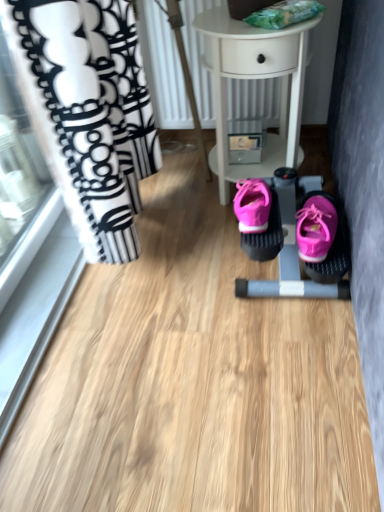
Question: Can pink suede shoe at center be found inside white glossy table at center?

Choices:
 (A) no
 (B) yes

Answer: (A)

Question: Is white glossy table at center positioned in front of pink suede shoe at center?

Choices:
 (A) no
 (B) yes

Answer: (A)

Question: Does white glossy table at center have a lesser width compared to pink suede shoe at center?

Choices:
 (A) no
 (B) yes

Answer: (A)

Question: Considering the relative sizes of white glossy table at center and pink suede shoe at center in the image provided, is white glossy table at center taller than pink suede shoe at center?

Choices:
 (A) yes
 (B) no

Answer: (A)

Question: Is white glossy table at center not near pink suede shoe at center?

Choices:
 (A) yes
 (B) no

Answer: (B)

Question: Does point (276, 182) appear closer or farther from the camera than point (309, 208)?

Choices:
 (A) closer
 (B) farther

Answer: (B)

Question: From a real-world perspective, is pink fabric baby carriage at center physically located above or below pink suede shoe at center?

Choices:
 (A) below
 (B) above

Answer: (A)

Question: Based on their sizes in the image, would you say pink fabric baby carriage at center is bigger or smaller than pink suede shoe at center?

Choices:
 (A) big
 (B) small

Answer: (A)

Question: Do you think pink fabric baby carriage at center is within pink suede shoe at center, or outside of it?

Choices:
 (A) inside
 (B) outside

Answer: (B)

Question: In the image, is pink suede shoe at center positioned in front of or behind pink fabric baby carriage at center?

Choices:
 (A) front
 (B) behind

Answer: (A)

Question: From their relative heights in the image, would you say pink suede shoe at center is taller or shorter than pink fabric baby carriage at center?

Choices:
 (A) short
 (B) tall

Answer: (A)

Question: Considering the positions of point (334, 214) and point (279, 222), is point (334, 214) closer or farther from the camera than point (279, 222)?

Choices:
 (A) closer
 (B) farther

Answer: (A)

Question: Which is correct: pink suede shoe at center is inside pink fabric baby carriage at center, or outside of it?

Choices:
 (A) inside
 (B) outside

Answer: (B)

Question: Is point (281, 146) closer or farther from the camera than point (256, 254)?

Choices:
 (A) farther
 (B) closer

Answer: (A)

Question: Looking at the image, does white glossy table at center seem bigger or smaller compared to pink fabric baby carriage at center?

Choices:
 (A) big
 (B) small

Answer: (A)